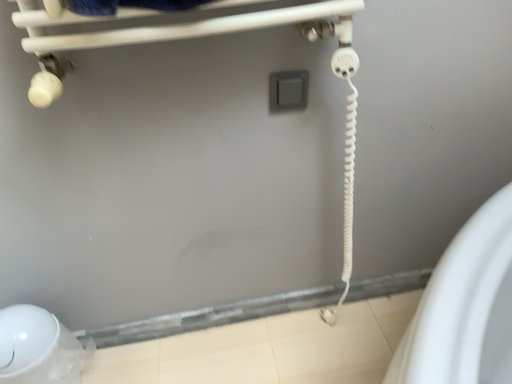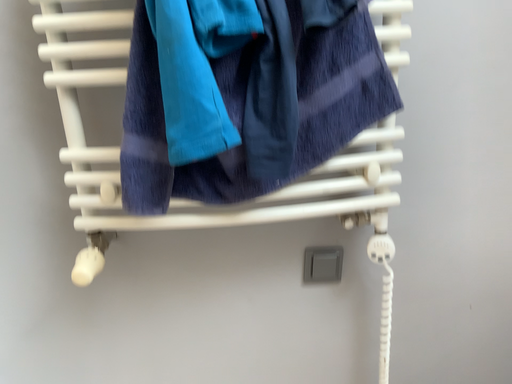
Question: How did the camera likely rotate when shooting the video?

Choices:
 (A) rotated upward
 (B) rotated downward

Answer: (A)